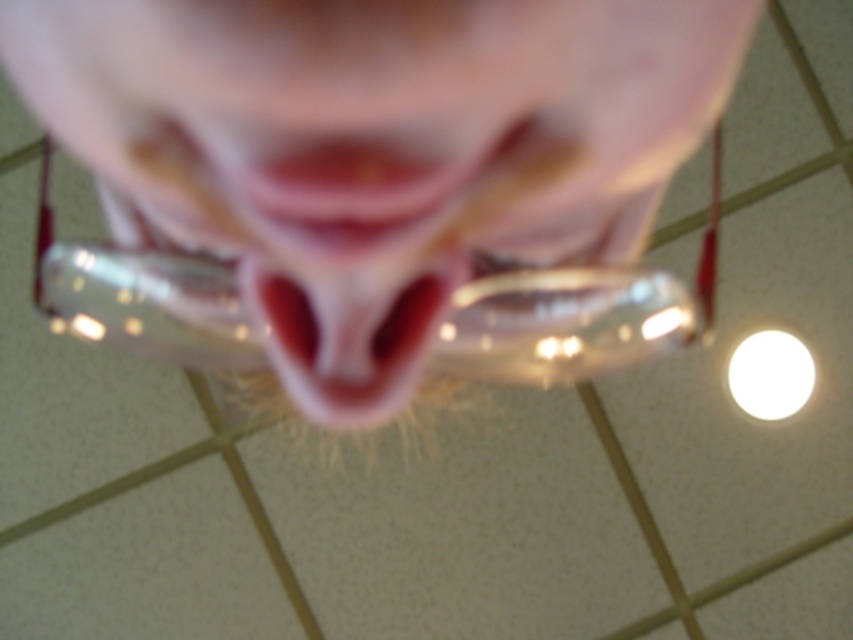
You are a photographer trying to capture a closeup of the pink translucent glasses at center. You are currently positioned 6 inches away from them. Based on the scene description, can you safely take the photo without moving closer?

The pink translucent glasses at center are 6.92 inches away from the viewer. Since you are already 6 inches away, you are close enough to take the photo without needing to move closer.

You are a dentist examining a patient. You notice the pink translucent glasses at center and the pink glossy lips at center. How far apart are these two features?

The pink translucent glasses at center and pink glossy lips at center are 2.14 inches apart.

You are a photographer trying to capture a closeup shot of a person. You want to ensure the subject is in focus. If the camera is focused at 7.77 inches, will the point at coordinates point (x=247, y=52) be in focus?

The distance of point (x=247, y=52) from the camera is 7.77 inches, so yes, the point at coordinates point (x=247, y=52) will be in focus since it matches the camera focus distance.